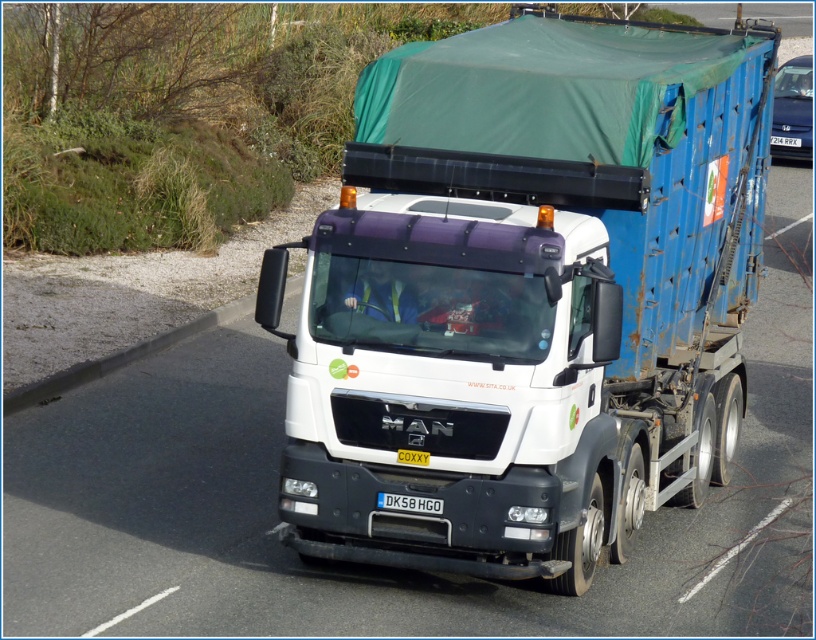
Question: Is metallic blue car at right to the left of white plastic license plate at center from the viewer's perspective?

Choices:
 (A) yes
 (B) no

Answer: (B)

Question: Is metallic blue car at right below yellow matte license plate at center?

Choices:
 (A) no
 (B) yes

Answer: (A)

Question: Which of the following is the closest to the observer?

Choices:
 (A) black plastic license plate at center
 (B) white matte trailer truck at center
 (C) white plastic license plate at center
 (D) metallic blue car at right

Answer: (A)

Question: Can you confirm if yellow matte license plate at center is positioned below white plastic license plate at center?

Choices:
 (A) no
 (B) yes

Answer: (B)

Question: Which point is farther to the camera?

Choices:
 (A) (432, 506)
 (B) (792, 109)

Answer: (B)

Question: Which object is farther from the camera taking this photo?

Choices:
 (A) white matte trailer truck at center
 (B) yellow matte license plate at center

Answer: (A)